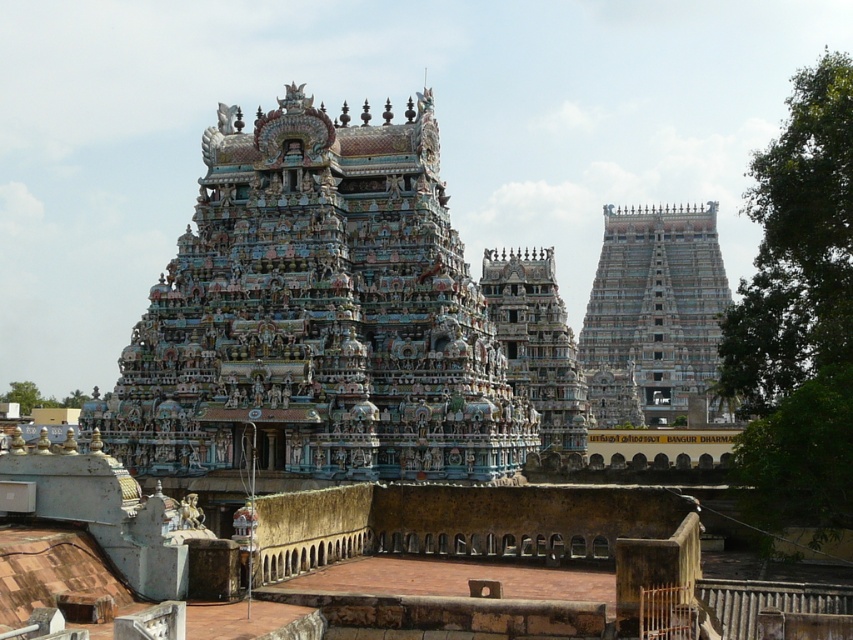
Does multicolored stone temple at center appear on the left side of multicolored ornate temple at center?

Correct, you'll find multicolored stone temple at center to the left of multicolored ornate temple at center.

Is point (282, 218) closer to viewer compared to point (567, 330)?

Yes, point (282, 218) is closer to viewer.

Where is `multicolored stone temple at center`? multicolored stone temple at center is located at coordinates (317, 316).

Which is more to the right, multicolored stone temple at center or blue stone temple at center?

blue stone temple at center

The height and width of the screenshot is (640, 853). Describe the element at coordinates (317, 316) in the screenshot. I see `multicolored stone temple at center` at that location.

Locate an element on the screen. multicolored stone temple at center is located at coordinates [317, 316].

Locate an element on the screen. The width and height of the screenshot is (853, 640). multicolored stone temple at center is located at coordinates (317, 316).

Does blue stone temple at center have a lesser width compared to multicolored ornate temple at center?

No, blue stone temple at center is not thinner than multicolored ornate temple at center.

Can you confirm if blue stone temple at center is positioned to the left of multicolored ornate temple at center?

In fact, blue stone temple at center is to the right of multicolored ornate temple at center.

Is point (648, 356) farther from camera compared to point (527, 268)?

Yes, it is.

Locate an element on the screen. This screenshot has width=853, height=640. blue stone temple at center is located at coordinates (653, 314).